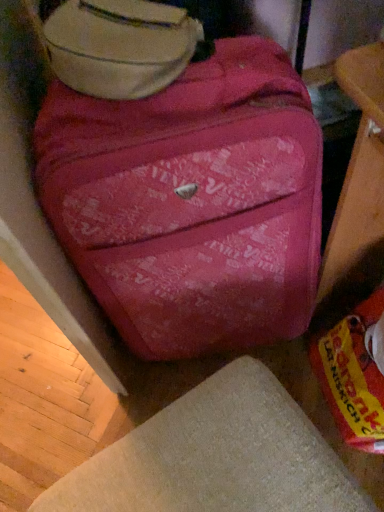
Question: Considering the relative positions of beige fabric ottoman at lower center and matte pink suitcase at upper center in the image provided, is beige fabric ottoman at lower center to the left of matte pink suitcase at upper center from the viewer's perspective?

Choices:
 (A) no
 (B) yes

Answer: (A)

Question: Is beige fabric ottoman at lower center to the right of matte pink suitcase at upper center from the viewer's perspective?

Choices:
 (A) yes
 (B) no

Answer: (A)

Question: From the image's perspective, would you say beige fabric ottoman at lower center is positioned over matte pink suitcase at upper center?

Choices:
 (A) no
 (B) yes

Answer: (A)

Question: Is beige fabric ottoman at lower center touching matte pink suitcase at upper center?

Choices:
 (A) no
 (B) yes

Answer: (A)

Question: Is beige fabric ottoman at lower center thinner than matte pink suitcase at upper center?

Choices:
 (A) yes
 (B) no

Answer: (B)

Question: Is beige fabric ottoman at lower center smaller than matte pink suitcase at upper center?

Choices:
 (A) yes
 (B) no

Answer: (B)

Question: Is beige fabric ottoman at lower center positioned in front of matte pink suitcase at center?

Choices:
 (A) yes
 (B) no

Answer: (A)

Question: Considering the relative sizes of beige fabric ottoman at lower center and matte pink suitcase at center in the image provided, is beige fabric ottoman at lower center shorter than matte pink suitcase at center?

Choices:
 (A) no
 (B) yes

Answer: (B)

Question: Are beige fabric ottoman at lower center and matte pink suitcase at center located far from each other?

Choices:
 (A) yes
 (B) no

Answer: (B)

Question: Can you confirm if beige fabric ottoman at lower center is bigger than matte pink suitcase at center?

Choices:
 (A) yes
 (B) no

Answer: (B)

Question: Are beige fabric ottoman at lower center and matte pink suitcase at center making contact?

Choices:
 (A) no
 (B) yes

Answer: (A)

Question: Can you confirm if beige fabric ottoman at lower center is taller than matte pink suitcase at center?

Choices:
 (A) yes
 (B) no

Answer: (B)

Question: Considering the relative sizes of matte pink suitcase at center and matte pink suitcase at upper center in the image provided, is matte pink suitcase at center wider than matte pink suitcase at upper center?

Choices:
 (A) no
 (B) yes

Answer: (B)